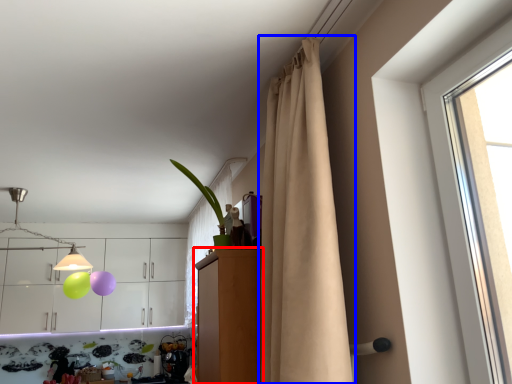
Question: Among these objects, which one is nearest to the camera, dresser (highlighted by a red box) or curtain (highlighted by a blue box)?

Choices:
 (A) dresser
 (B) curtain

Answer: (B)